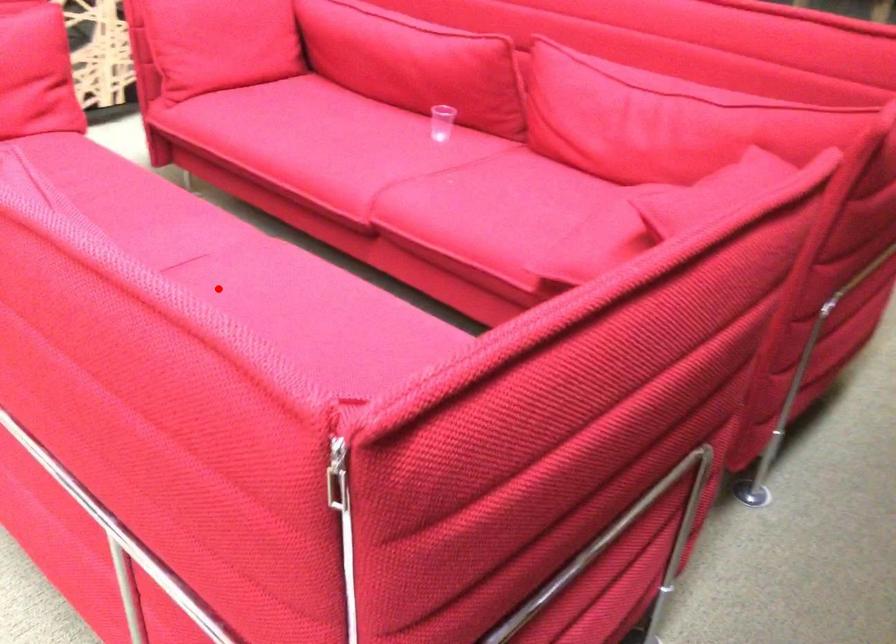
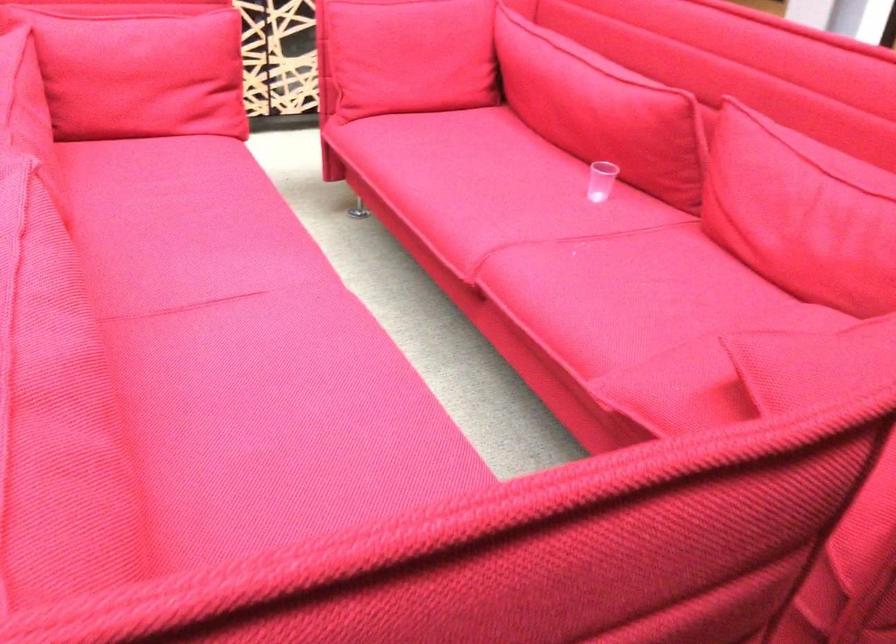
Find the pixel in the second image that matches the highlighted location in the first image.

(243, 337)